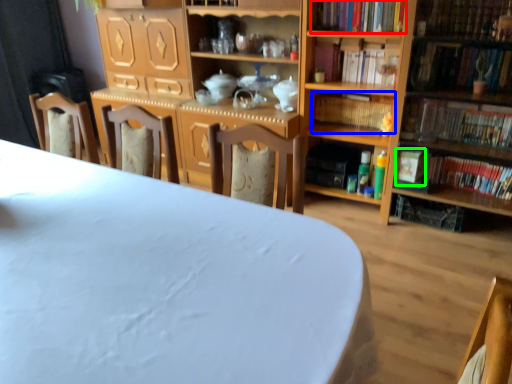
Question: Considering the real-world distances, which object is farthest from book (highlighted by a red box)? book (highlighted by a blue box) or paperback book (highlighted by a green box)?

Choices:
 (A) book
 (B) paperback book

Answer: (B)